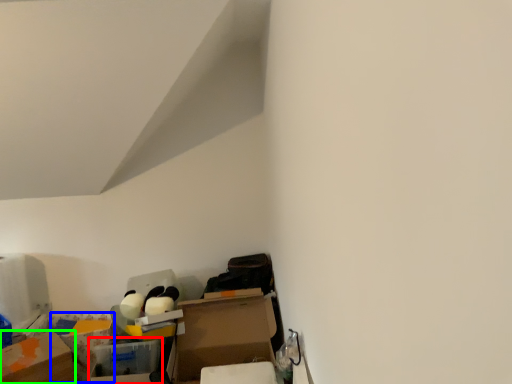
Question: Which is farther away from storage box (highlighted by a red box)? storage box (highlighted by a blue box) or cardboard box (highlighted by a green box)?

Choices:
 (A) storage box
 (B) cardboard box

Answer: (A)